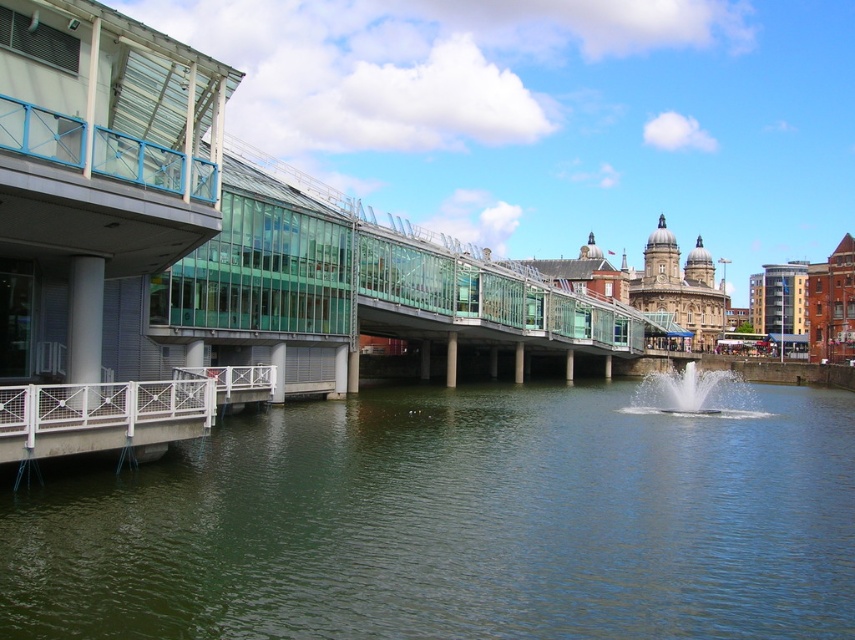
You are a pedestrian wanting to cross the transparent glass bridge at center. There is also white frothy water at center nearby. Which one is wider?

The transparent glass bridge at center is wider than the white frothy water at center.

You are standing at the origin point in the scene. Which direction should you move to reach the greenish water at center?

The greenish water at center is located at point (455, 524), so you should move towards the right and slightly upwards from your current position to reach it.

You are a pedestrian standing on the walkway of the modern building on the left. You want to cross to the other side of the water. Can you see the greenish water at center from your current position under the transparent glass bridge at center?

The greenish water at center is positioned under the transparent glass bridge at center, so yes, you can see the greenish water at center through the transparent glass bridge at center from your position on the walkway.